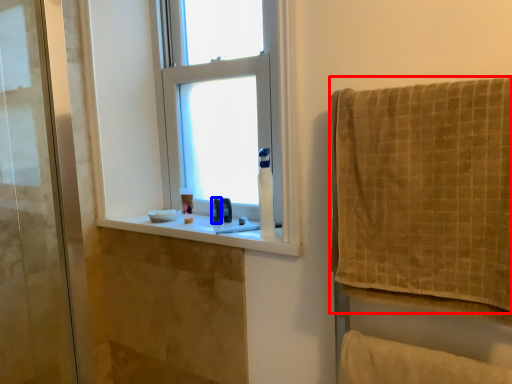
Question: Which of the following is the farthest to the observer, towel (highlighted by a red box) or toiletry (highlighted by a blue box)?

Choices:
 (A) towel
 (B) toiletry

Answer: (B)